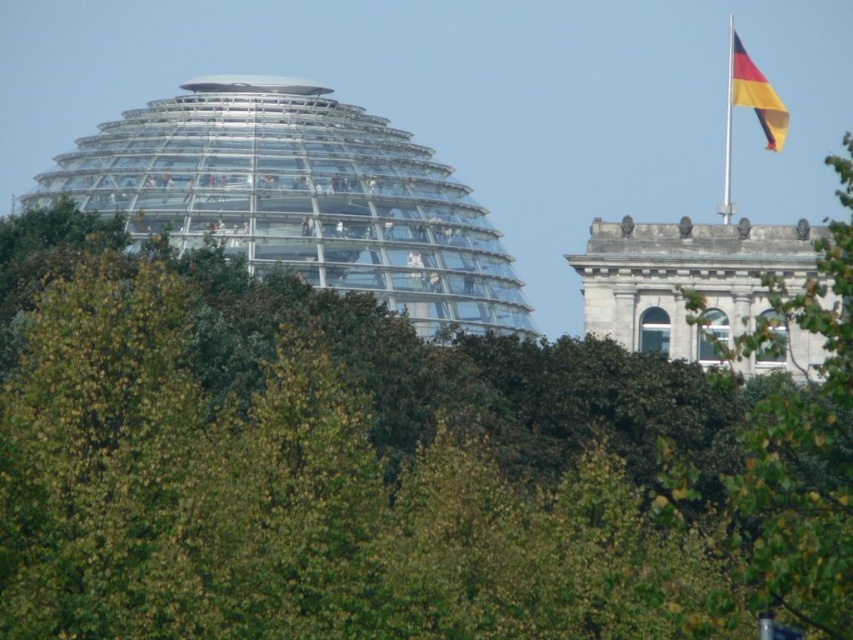
Question: Is white stone tower at upper right bigger than yellow and red fabric flag at upper right?

Choices:
 (A) yes
 (B) no

Answer: (B)

Question: Which point appears closest to the camera in this image?

Choices:
 (A) (807, 538)
 (B) (198, 170)
 (C) (619, 522)
 (D) (726, 141)

Answer: (A)

Question: Considering the real-world distances, which object is farthest from the white stone tower at upper right?

Choices:
 (A) metallic flag pole at upper right
 (B) green leafy tree at upper right
 (C) green leafy tree at center
 (D) yellow and red fabric flag at upper right

Answer: (D)

Question: Where is green leafy tree at upper right located in relation to metallic flag pole at upper right in the image?

Choices:
 (A) above
 (B) below

Answer: (B)

Question: Which object is the farthest from the transparent glass dome at upper left?

Choices:
 (A) green leafy tree at upper right
 (B) white stone tower at upper right

Answer: (A)

Question: Does green leafy tree at upper right appear over metallic flag pole at upper right?

Choices:
 (A) yes
 (B) no

Answer: (B)